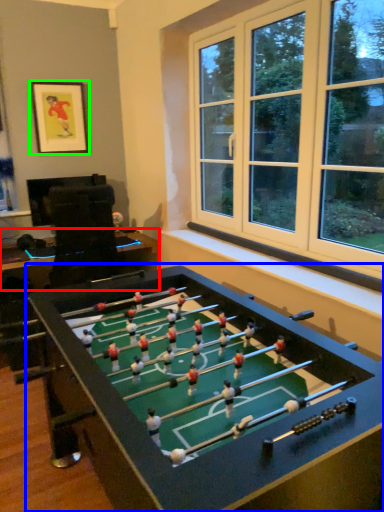
Question: Based on their relative distances, which object is farther from table (highlighted by a red box)? Choose from table (highlighted by a blue box) and picture frame (highlighted by a green box).

Choices:
 (A) table
 (B) picture frame

Answer: (A)